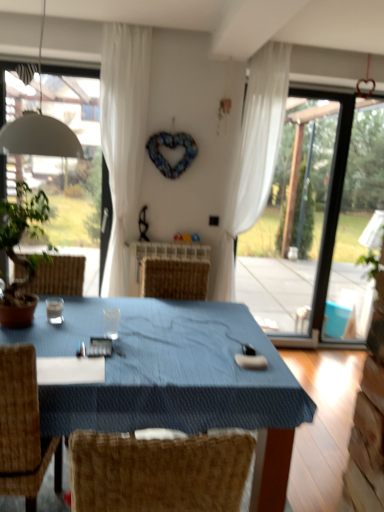
Question: Can you confirm if blue fabric table at center is wider than white matte lampshade at upper left?

Choices:
 (A) yes
 (B) no

Answer: (A)

Question: Is blue fabric table at center smaller than white matte lampshade at upper left?

Choices:
 (A) no
 (B) yes

Answer: (A)

Question: Is blue fabric table at center shorter than white matte lampshade at upper left?

Choices:
 (A) no
 (B) yes

Answer: (A)

Question: Is blue fabric table at center thinner than white matte lampshade at upper left?

Choices:
 (A) no
 (B) yes

Answer: (A)

Question: Is blue fabric table at center far away from white matte lampshade at upper left?

Choices:
 (A) no
 (B) yes

Answer: (B)

Question: Can you confirm if blue fabric table at center is positioned to the left of white matte lampshade at upper left?

Choices:
 (A) no
 (B) yes

Answer: (A)

Question: Is transparent glass coffee cup at center to the right of blue fabric table at center from the viewer's perspective?

Choices:
 (A) yes
 (B) no

Answer: (B)

Question: Is the depth of transparent glass coffee cup at center less than that of blue fabric table at center?

Choices:
 (A) yes
 (B) no

Answer: (B)

Question: From a real-world perspective, is transparent glass coffee cup at center under blue fabric table at center?

Choices:
 (A) no
 (B) yes

Answer: (A)

Question: From the image's perspective, is transparent glass coffee cup at center on blue fabric table at center?

Choices:
 (A) no
 (B) yes

Answer: (B)

Question: Is blue fabric table at center completely or partially inside transparent glass coffee cup at center?

Choices:
 (A) yes
 (B) no

Answer: (B)

Question: Is transparent glass coffee cup at center not near blue fabric table at center?

Choices:
 (A) no
 (B) yes

Answer: (A)

Question: Considering the relative positions of transparent glass coffee cup at center and white sheer curtain at upper center, the 2th curtain from the left, in the image provided, is transparent glass coffee cup at center to the left of white sheer curtain at upper center, the 2th curtain from the left, from the viewer's perspective?

Choices:
 (A) no
 (B) yes

Answer: (B)